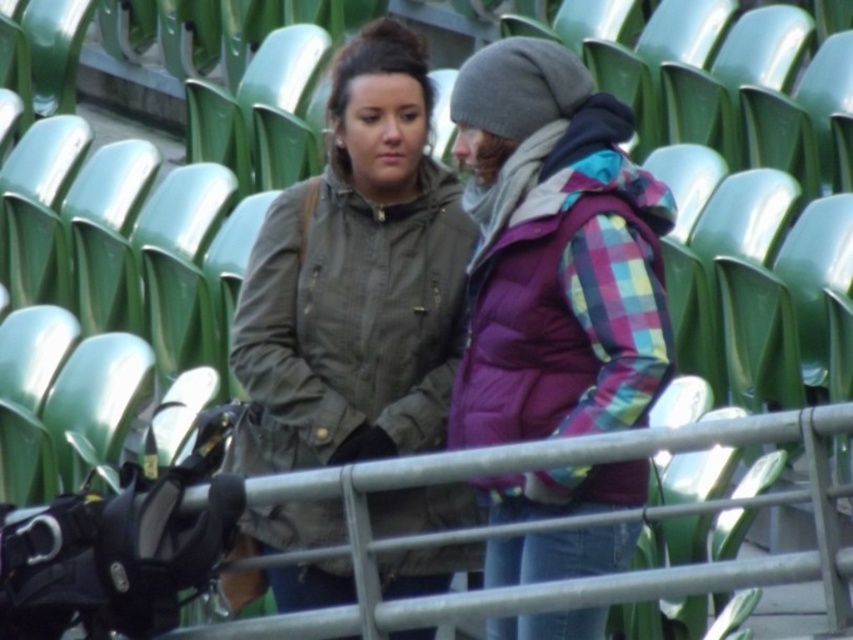
Does matte olive green jacket at center have a greater width compared to plaid puffer jacket at center?

Correct, the width of matte olive green jacket at center exceeds that of plaid puffer jacket at center.

Does point (405, 520) lie in front of point (531, 317)?

No, (405, 520) is behind (531, 317).

Locate an element on the screen. This screenshot has width=853, height=640. matte olive green jacket at center is located at coordinates (357, 280).